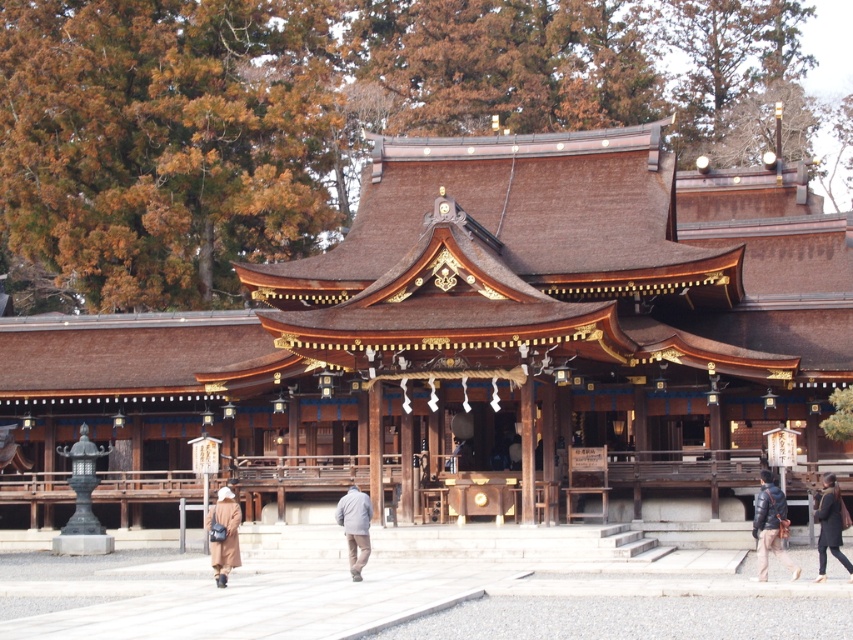
Question: Which point appears farthest from the camera in this image?

Choices:
 (A) (221, 500)
 (B) (850, 573)

Answer: (A)

Question: In this image, where is black leather jacket at lower right located relative to gray woolen jacket at center?

Choices:
 (A) left
 (B) right

Answer: (B)

Question: Which point is closer to the camera taking this photo?

Choices:
 (A) (778, 515)
 (B) (229, 554)

Answer: (B)

Question: Which point is closer to the camera?

Choices:
 (A) (352, 496)
 (B) (827, 515)
 (C) (213, 515)

Answer: (C)

Question: Can you confirm if dark brown leather jacket at lower right is bigger than brown wool coat at lower left?

Choices:
 (A) no
 (B) yes

Answer: (A)

Question: Is dark brown leather jacket at lower right wider than gray woolen jacket at center?

Choices:
 (A) yes
 (B) no

Answer: (A)